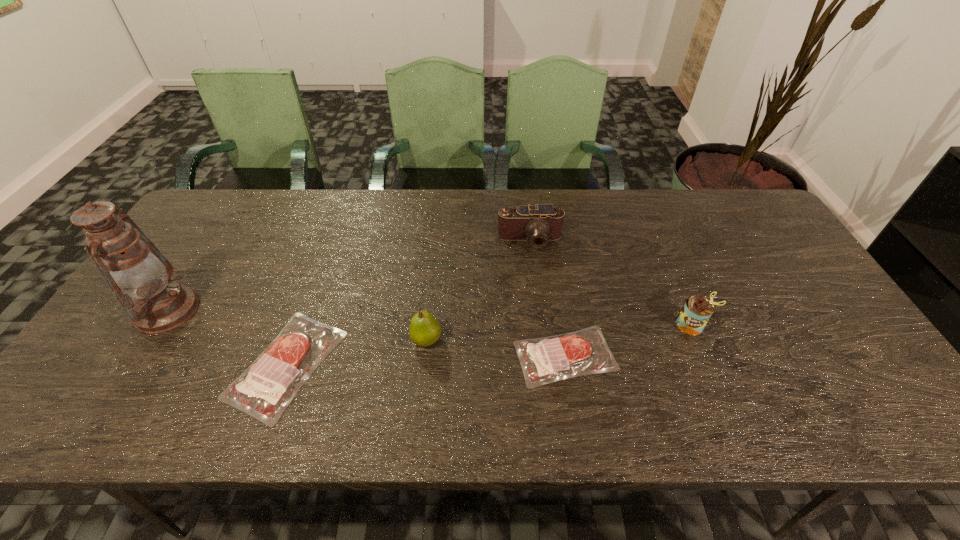
Locate an element on the screen. The image size is (960, 540). free space at the right edge is located at coordinates pos(794,288).

This screenshot has height=540, width=960. What are the coordinates of `vacant area at the far left corner` in the screenshot? It's located at (217, 225).

This screenshot has width=960, height=540. Find the location of `free space at the far right corner`. free space at the far right corner is located at coordinates (732, 198).

Find the location of a particular element. free spot at the near right corner of the desktop is located at coordinates (858, 389).

I want to click on free space between the farthest object and the right steak, so click(x=547, y=299).

The height and width of the screenshot is (540, 960). I want to click on empty space between the camera and the tallest object, so click(348, 275).

What are the coordinates of `vacant space that's between the taller steak and the leftmost object` in the screenshot? It's located at (227, 338).

Locate an element on the screen. The height and width of the screenshot is (540, 960). free space between the rightmost object and the fifth tallest object is located at coordinates (489, 345).

Where is `vacant area that lies between the camera and the rightmost object`? vacant area that lies between the camera and the rightmost object is located at coordinates (611, 283).

Locate an element on the screen. free area in between the leftmost object and the second object from left to right is located at coordinates (227, 338).